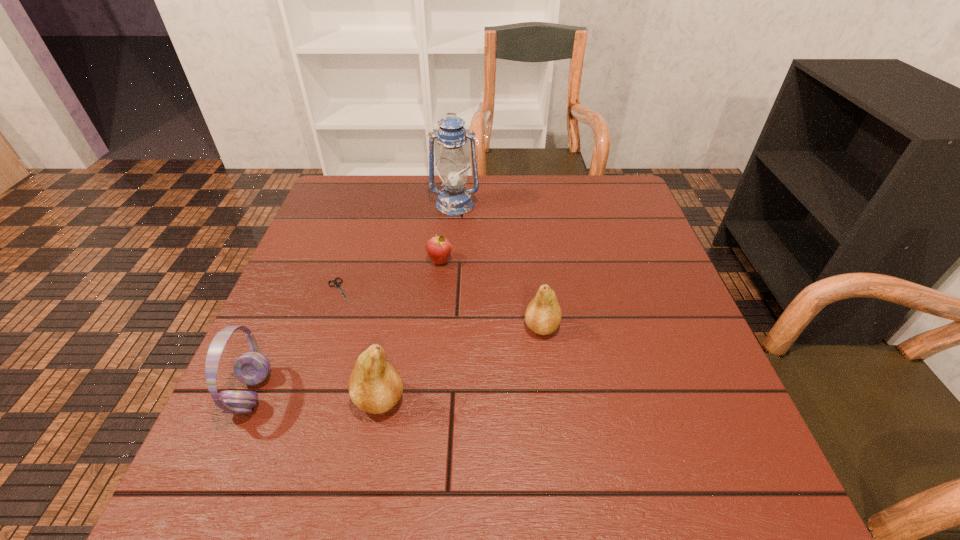
Locate an element on the screen. The image size is (960, 540). vacant area that lies between the left pear and the third nearest object is located at coordinates (461, 363).

This screenshot has width=960, height=540. I want to click on vacant area that lies between the shortest object and the farthest object, so click(x=397, y=247).

Where is `vacant area that lies between the shortest object and the nearer pear`? The image size is (960, 540). vacant area that lies between the shortest object and the nearer pear is located at coordinates (360, 345).

Identify the location of free point between the taller pear and the apple. The image size is (960, 540). (410, 330).

At what (x,y) coordinates should I click in order to perform the action: click on vacant space that is in between the nearer pear and the fifth object from right to left. Please return your answer as a coordinate pair (x, y). The height and width of the screenshot is (540, 960). Looking at the image, I should click on (360, 345).

Locate an element on the screen. blank region between the shortest object and the shorter pear is located at coordinates (441, 308).

You are a GUI agent. You are given a task and a screenshot of the screen. Output one action in this format:
    pyautogui.click(x=<x>, y=<y>)
    Task: Click on the vacant point located between the left pear and the second object from left to right
    This screenshot has height=540, width=960.
    Given the screenshot: What is the action you would take?
    [x=360, y=345]

Where is `vacant point located between the headset and the nearer pear`? vacant point located between the headset and the nearer pear is located at coordinates (316, 396).

Image resolution: width=960 pixels, height=540 pixels. Find the location of `free space that is in between the shorter pear and the second object from left to right`. free space that is in between the shorter pear and the second object from left to right is located at coordinates (441, 308).

Image resolution: width=960 pixels, height=540 pixels. What are the coordinates of `object identified as the second closest to the leftmost object` in the screenshot? It's located at (336, 284).